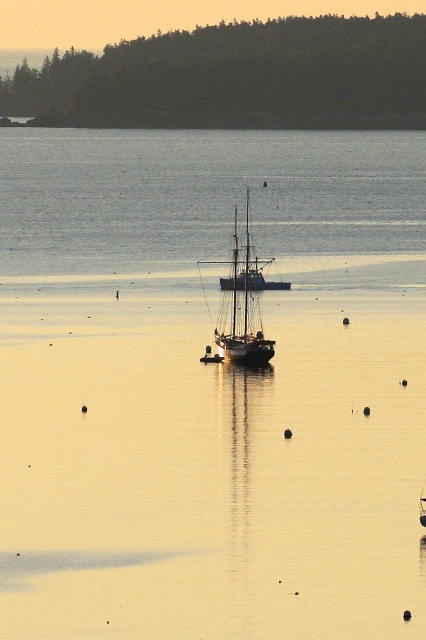
You are a sailor trying to navigate through the clear water at center and the wooden sailboat at center. Which object is positioned to the right of the other?

The clear water at center is to the right of the wooden sailboat at center.

You are a sailor navigating a small boat and need to locate the clear water at center. According to the coordinates provided, where exactly should you steer your boat to find it?

The clear water at center is located at coordinates point (203, 196). Steer your boat to that exact point to find it.